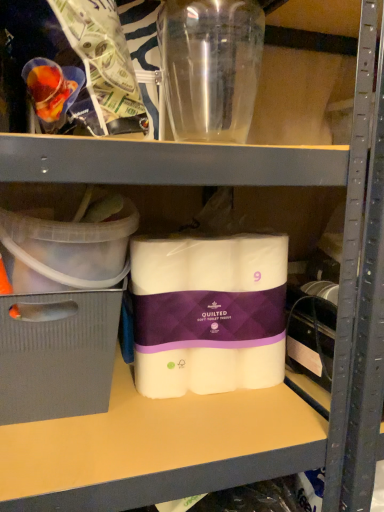
Question: Are clear plastic container at left, acting as the first storage box starting from the top, and gray cardboard box at left, the 2th storage box viewed from the top, making contact?

Choices:
 (A) yes
 (B) no

Answer: (B)

Question: Is clear plastic container at left, the 2th storage box positioned from the bottom, behind gray cardboard box at left, the 2th storage box viewed from the top?

Choices:
 (A) yes
 (B) no

Answer: (B)

Question: Does clear plastic container at left, the 2th storage box positioned from the bottom, appear on the left side of gray cardboard box at left, the 2th storage box viewed from the top?

Choices:
 (A) yes
 (B) no

Answer: (B)

Question: Considering the relative sizes of clear plastic container at left, the 2th storage box positioned from the bottom, and gray cardboard box at left, the 2th storage box viewed from the top, in the image provided, is clear plastic container at left, the 2th storage box positioned from the bottom, shorter than gray cardboard box at left, the 2th storage box viewed from the top,?

Choices:
 (A) yes
 (B) no

Answer: (A)

Question: Does clear plastic container at left, the 2th storage box positioned from the bottom, contain gray cardboard box at left, the 2th storage box viewed from the top?

Choices:
 (A) yes
 (B) no

Answer: (B)

Question: Is point (273, 246) closer or farther from the camera than point (54, 314)?

Choices:
 (A) closer
 (B) farther

Answer: (B)

Question: From the image's perspective, is white quilted toilet paper at center positioned above or below gray cardboard box at left, which is counted as the 1th storage box, starting from the bottom?

Choices:
 (A) above
 (B) below

Answer: (A)

Question: Is white quilted toilet paper at center bigger or smaller than gray cardboard box at left, which is counted as the 1th storage box, starting from the bottom?

Choices:
 (A) small
 (B) big

Answer: (A)

Question: Considering their positions, is white quilted toilet paper at center located in front of or behind gray cardboard box at left, which is counted as the 1th storage box, starting from the bottom?

Choices:
 (A) behind
 (B) front

Answer: (A)

Question: Based on their sizes in the image, would you say gray cardboard box at left, which is counted as the 1th storage box, starting from the bottom, is bigger or smaller than white quilted toilet paper at center?

Choices:
 (A) small
 (B) big

Answer: (B)

Question: Is point (43, 389) closer or farther from the camera than point (137, 321)?

Choices:
 (A) farther
 (B) closer

Answer: (B)

Question: Which is correct: gray cardboard box at left, which is counted as the 1th storage box, starting from the bottom, is inside white quilted toilet paper at center, or outside of it?

Choices:
 (A) inside
 (B) outside

Answer: (B)

Question: From a real-world perspective, is gray cardboard box at left, the 2th storage box viewed from the top, positioned above or below white quilted toilet paper at center?

Choices:
 (A) below
 (B) above

Answer: (A)

Question: From the image's perspective, relative to gray cardboard box at left, the 2th storage box viewed from the top, is transparent plastic bottle at upper center above or below?

Choices:
 (A) below
 (B) above

Answer: (B)

Question: Is transparent plastic bottle at upper center taller or shorter than gray cardboard box at left, the 2th storage box viewed from the top?

Choices:
 (A) short
 (B) tall

Answer: (B)